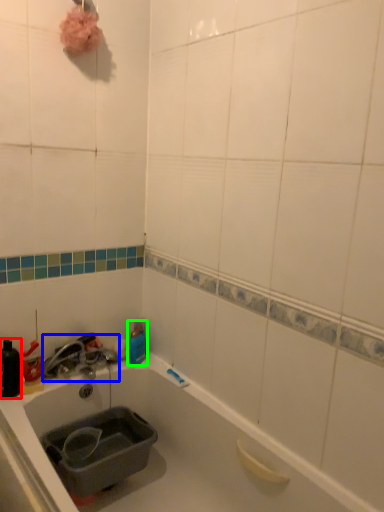
Question: Estimate the real-world distances between objects in this image. Which object is farther from bottle (highlighted by a red box), faucet (highlighted by a blue box) or bottle (highlighted by a green box)?

Choices:
 (A) faucet
 (B) bottle

Answer: (B)